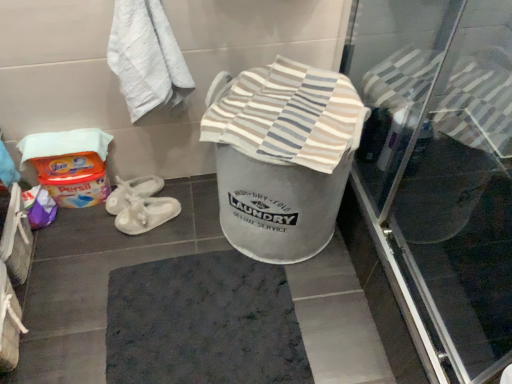
What do you see at coordinates (203, 323) in the screenshot? I see `dark gray textured bath mat at center` at bounding box center [203, 323].

The height and width of the screenshot is (384, 512). What are the coordinates of `transparent glass screen door at upper right` in the screenshot? It's located at [x=439, y=173].

Does point (490, 52) come in front of point (162, 80)?

No, (490, 52) is behind (162, 80).

Between transparent glass screen door at upper right and white textured towel at upper left, which one has smaller size?

With smaller size is white textured towel at upper left.

Is transparent glass screen door at upper right in front of or behind white textured towel at upper left in the image?

transparent glass screen door at upper right is positioned closer to the viewer than white textured towel at upper left.

Can you confirm if transparent glass screen door at upper right is positioned to the right of white textured towel at upper left?

Yes.

How distant is transparent glass screen door at upper right from striped cotton towel at center?

13.67 inches.

Is the depth of transparent glass screen door at upper right greater than that of striped cotton towel at center?

No, it is in front of striped cotton towel at center.

Identify the location of screen door below the striped cotton towel at center (from the image's perspective). (439, 173).

From the image's perspective, who appears lower, transparent glass screen door at upper right or striped cotton towel at center?

transparent glass screen door at upper right appears lower in the image.

What are the coordinates of `towel above the striped cotton towel at center (from a real-world perspective)` in the screenshot? It's located at (147, 58).

Is white textured towel at upper left not close to striped cotton towel at center?

No, there isn't a large distance between white textured towel at upper left and striped cotton towel at center.

Does white textured towel at upper left have a smaller size compared to striped cotton towel at center?

Actually, white textured towel at upper left might be larger than striped cotton towel at center.

Does white textured towel at upper left have a greater width compared to striped cotton towel at center?

No, white textured towel at upper left is not wider than striped cotton towel at center.

Do you think white textured towel at upper left is within transparent glass screen door at upper right, or outside of it?

white textured towel at upper left cannot be found inside transparent glass screen door at upper right.

Which object is positioned more to the left, white textured towel at upper left or transparent glass screen door at upper right?

From the viewer's perspective, white textured towel at upper left appears more on the left side.

Could you tell me if white textured towel at upper left is turned towards transparent glass screen door at upper right?

No, white textured towel at upper left is not facing towards transparent glass screen door at upper right.

Is the surface of white textured towel at upper left in direct contact with transparent glass screen door at upper right?

white textured towel at upper left is not next to transparent glass screen door at upper right, and they're not touching.

In the image, there is a white textured towel at upper left. Identify the location of bath mat below it (from the image's perspective). The width and height of the screenshot is (512, 384). (203, 323).

Is dark gray textured bath mat at center thinner than white textured towel at upper left?

No, dark gray textured bath mat at center is not thinner than white textured towel at upper left.

Is dark gray textured bath mat at center shorter than white textured towel at upper left?

Yes, dark gray textured bath mat at center is shorter than white textured towel at upper left.

Is dark gray textured bath mat at center facing away from white textured towel at upper left?

dark gray textured bath mat at center does not have its back to white textured towel at upper left.

From the picture: Are striped cotton towel at center and transparent glass screen door at upper right far apart?

They are positioned close to each other.

Which object is further away from the camera taking this photo, striped cotton towel at center or transparent glass screen door at upper right?

striped cotton towel at center.

What's the angular difference between striped cotton towel at center and transparent glass screen door at upper right's facing directions?

The angular difference between striped cotton towel at center and transparent glass screen door at upper right is 60.1 degrees.

From their relative heights in the image, would you say striped cotton towel at center is taller or shorter than transparent glass screen door at upper right?

Considering their sizes, striped cotton towel at center has less height than transparent glass screen door at upper right.

Does dark gray textured bath mat at center come in front of striped cotton towel at center?

That is False.

Based on the photo, is striped cotton towel at center surrounded by dark gray textured bath mat at center?

No, striped cotton towel at center is located outside of dark gray textured bath mat at center.

Does dark gray textured bath mat at center have a larger size compared to striped cotton towel at center?

Actually, dark gray textured bath mat at center might be smaller than striped cotton towel at center.

Who is shorter, dark gray textured bath mat at center or striped cotton towel at center?

With less height is dark gray textured bath mat at center.

At what (x,y) coordinates should I click in order to perform the action: click on screen door in front of the white textured towel at upper left. Please return your answer as a coordinate pair (x, y). Looking at the image, I should click on tap(439, 173).

Image resolution: width=512 pixels, height=384 pixels. Find the location of `screen door below the striped cotton towel at center (from the image's perspective)`. screen door below the striped cotton towel at center (from the image's perspective) is located at coordinates (439, 173).

From the image, which object appears to be farther from striped cotton towel at center, transparent glass screen door at upper right or white textured towel at upper left?

The object further to striped cotton towel at center is transparent glass screen door at upper right.

From the image, which object appears to be farther from white textured towel at upper left, dark gray textured bath mat at center or transparent glass screen door at upper right?

Among the two, transparent glass screen door at upper right is located further to white textured towel at upper left.

Based on their spatial positions, is striped cotton towel at center or dark gray textured bath mat at center further from transparent glass screen door at upper right?

dark gray textured bath mat at center.

Based on their spatial positions, is striped cotton towel at center or transparent glass screen door at upper right further from dark gray textured bath mat at center?

transparent glass screen door at upper right.

Which object lies nearer to the anchor point striped cotton towel at center, dark gray textured bath mat at center or white textured towel at upper left?

Based on the image, white textured towel at upper left appears to be nearer to striped cotton towel at center.

From the image, which object appears to be nearer to striped cotton towel at center, dark gray textured bath mat at center or transparent glass screen door at upper right?

Based on the image, transparent glass screen door at upper right appears to be nearer to striped cotton towel at center.

In the scene shown: When comparing their distances from dark gray textured bath mat at center, does striped cotton towel at center or white textured towel at upper left seem further?

Among the two, white textured towel at upper left is located further to dark gray textured bath mat at center.

Based on the photo, from the image, which object appears to be nearer to white textured towel at upper left, striped cotton towel at center or dark gray textured bath mat at center?

striped cotton towel at center is closer to white textured towel at upper left.

You are a GUI agent. You are given a task and a screenshot of the screen. Output one action in this format:
    pyautogui.click(x=<x>, y=<y>)
    Task: Click on the beach towel between transparent glass screen door at upper right and dark gray textured bath mat at center along the z-axis
    The width and height of the screenshot is (512, 384).
    Given the screenshot: What is the action you would take?
    pyautogui.click(x=285, y=115)

Where is `screen door between white textured towel at upper left and dark gray textured bath mat at center vertically`? The image size is (512, 384). screen door between white textured towel at upper left and dark gray textured bath mat at center vertically is located at coordinates (439, 173).

Where is `beach towel between white textured towel at upper left and dark gray textured bath mat at center vertically`? beach towel between white textured towel at upper left and dark gray textured bath mat at center vertically is located at coordinates (285, 115).

The width and height of the screenshot is (512, 384). In order to click on beach towel between white textured towel at upper left and transparent glass screen door at upper right in the horizontal direction in this screenshot , I will do `click(285, 115)`.